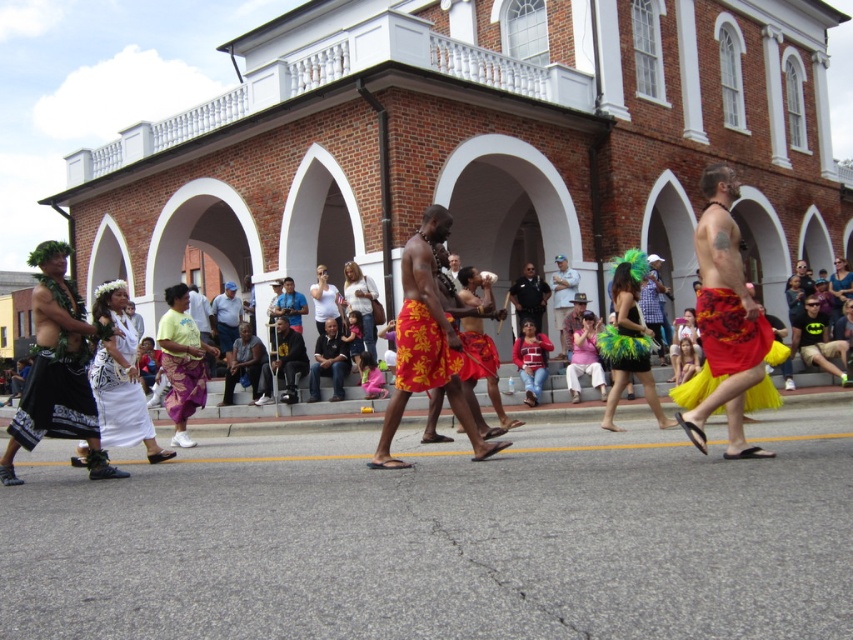
You are a photographer standing at the center of the street. You want to take a photo that includes both the point at coordinates point(x=318, y=358) and point(x=54, y=426). Based on their positions, which point is closer to your camera lens?

Point(x=54, y=426) is closer to the camera lens because it is positioned closer to the photographer than point(x=318, y=358), which is further away.

You are a photographer trying to capture the performers in the scene. You notice the multicolored fabric at center and the black woven skirt at left. Which object should you focus on to get a larger subject in your photo?

The multicolored fabric at center is bigger than the black woven skirt at left, so focusing on the multicolored fabric at center will result in a larger subject in the photo.

You are a photographer who wants to take a photo of the multicolored fabric at center and the blue fabric camera at center. Which object should you focus on first if you want to capture both in the same frame without moving the camera?

The multicolored fabric at center is much taller than the blue fabric camera at center, so you should focus on the multicolored fabric at center first to ensure it fits within the frame.